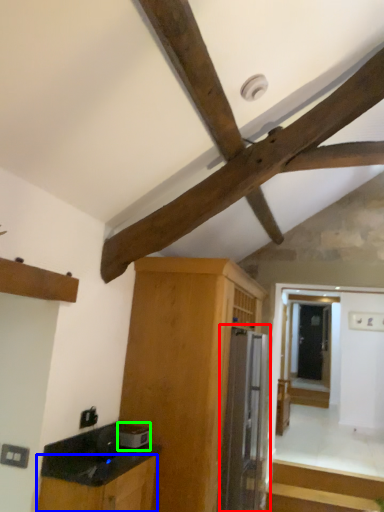
Question: Which object is the farthest from appliance (highlighted by a red box)? Choose among these: cabinetry (highlighted by a blue box) or appliance (highlighted by a green box).

Choices:
 (A) cabinetry
 (B) appliance

Answer: (A)